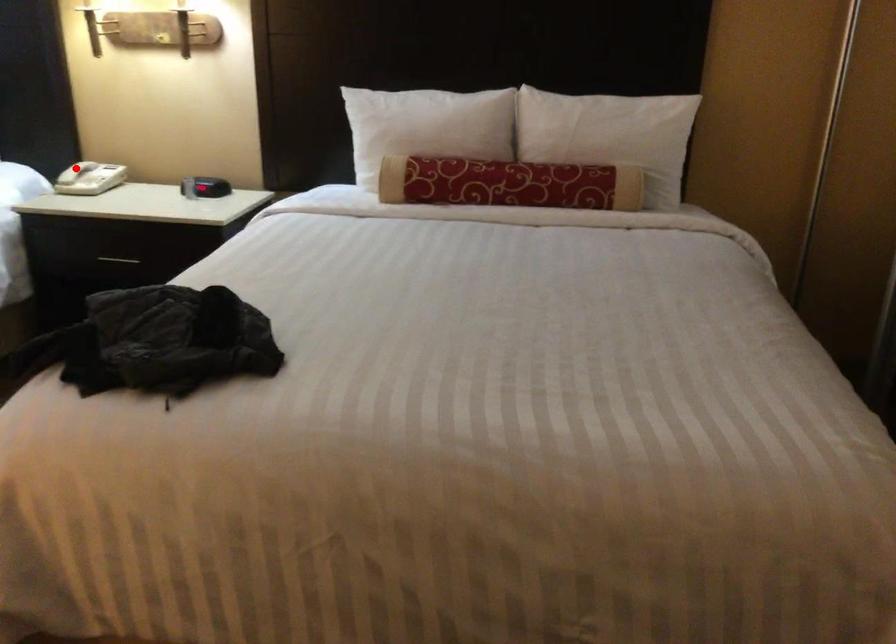
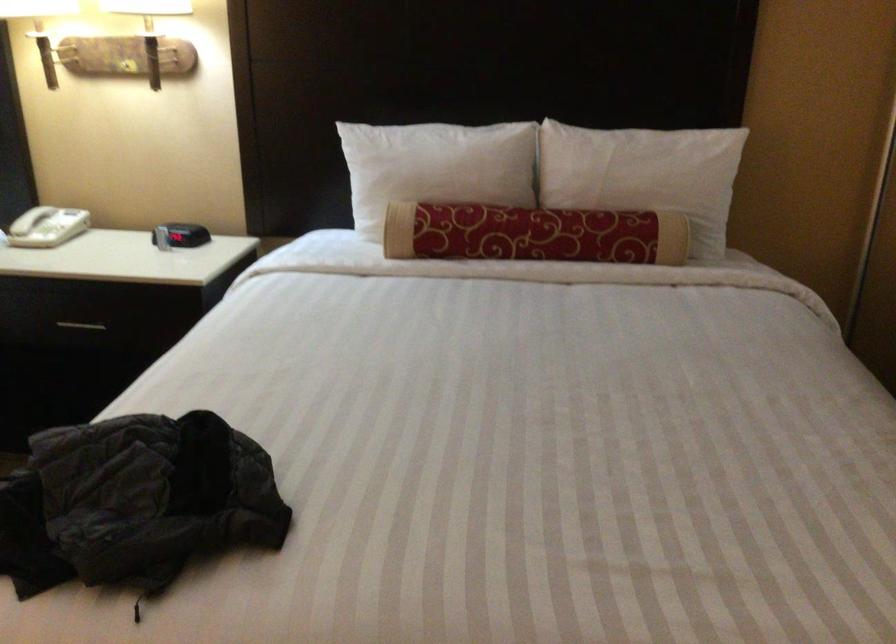
Question: I am providing you with two images of the same scene from different viewpoints. A red point is marked on the first image. At the location where the point appears in image 1, is it still visible in image 2?

Choices:
 (A) Yes
 (B) No

Answer: (A)